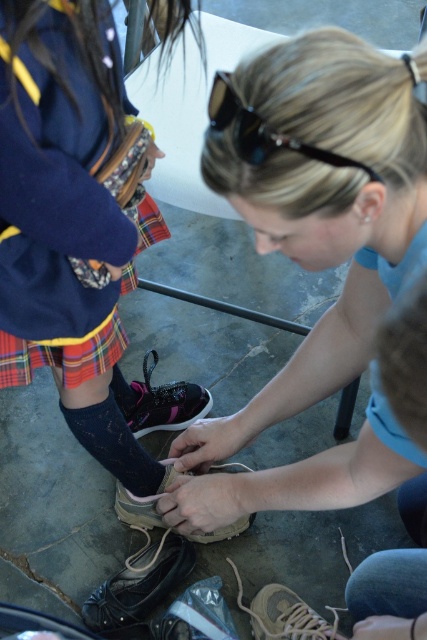
Image resolution: width=427 pixels, height=640 pixels. Find the location of `plaid fabric skirt at lower left`. plaid fabric skirt at lower left is located at coordinates (61, 355).

The width and height of the screenshot is (427, 640). What do you see at coordinates (61, 355) in the screenshot? I see `plaid fabric skirt at lower left` at bounding box center [61, 355].

At what (x,y) coordinates should I click in order to perform the action: click on plaid fabric skirt at lower left. Please return your answer as a coordinate pair (x, y). The image size is (427, 640). Looking at the image, I should click on (61, 355).

Can you confirm if black mesh sock at lower left is positioned above brown suede shoe at center?

Yes, black mesh sock at lower left is above brown suede shoe at center.

Does black mesh sock at lower left appear under brown suede shoe at center?

No, black mesh sock at lower left is not below brown suede shoe at center.

Find the location of `black mesh sock at lower left`. black mesh sock at lower left is located at coordinates (114, 444).

Find the location of a particular element. The height and width of the screenshot is (640, 427). black mesh sock at lower left is located at coordinates (114, 444).

Between leather shoe at lower center and plaid fabric skirt at lower left, which one has less height?

Standing shorter between the two is plaid fabric skirt at lower left.

Consider the image. Between leather shoe at lower center and plaid fabric skirt at lower left, which one appears on the right side from the viewer's perspective?

leather shoe at lower center is more to the right.

Between point (187, 572) and point (20, 365), which one is positioned in front?

Point (20, 365)

Where is `leather shoe at lower center`? leather shoe at lower center is located at coordinates (139, 588).